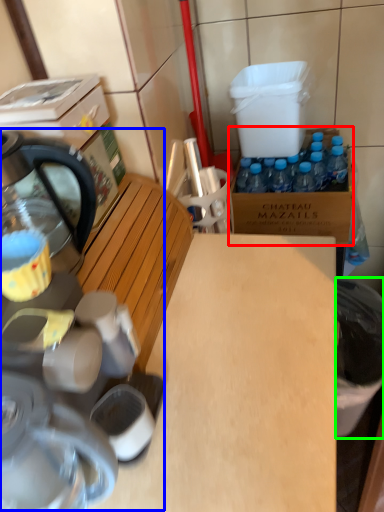
Question: Which object is positioned farthest from cardboard box (highlighted by a red box)? Select from coffee machine (highlighted by a blue box) and trash bin/can (highlighted by a green box).

Choices:
 (A) coffee machine
 (B) trash bin/can

Answer: (A)